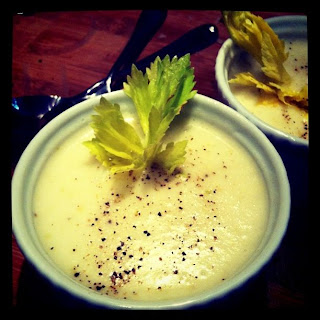
At what (x,y) coordinates should I click in order to perform the action: click on spoon. Please return your answer as a coordinate pair (x, y). Looking at the image, I should click on (43, 98).